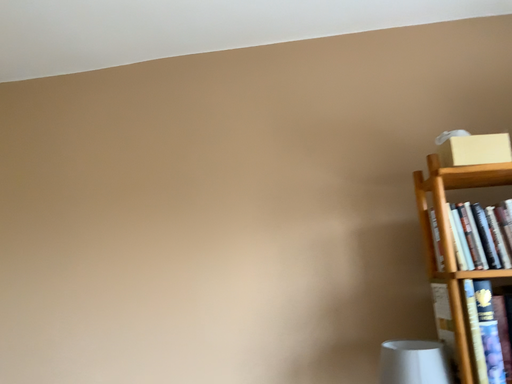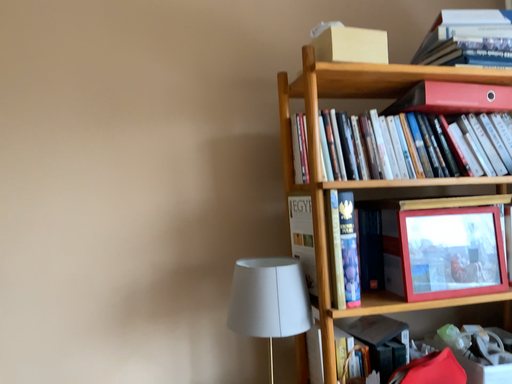
Question: Which way did the camera rotate in the video?

Choices:
 (A) rotated downward
 (B) rotated upward

Answer: (A)